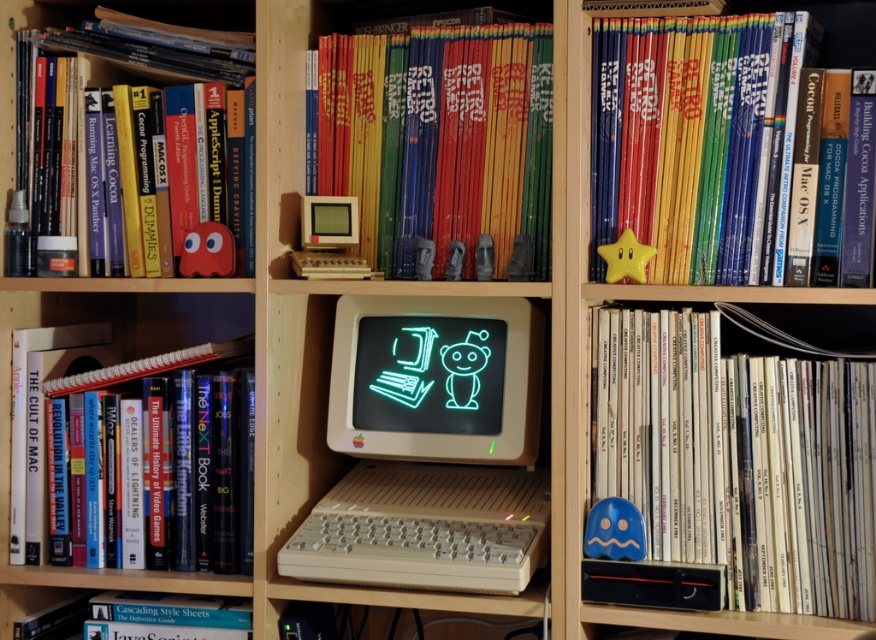
Question: Which point is closer to the camera taking this photo?

Choices:
 (A) click(79, 195)
 (B) click(708, 40)
 (C) click(668, 369)
 (D) click(27, 369)

Answer: (B)

Question: Does blue matte vinyl record at lower right lie in front of spiral-bound paper notebook at left?

Choices:
 (A) yes
 (B) no

Answer: (A)

Question: Is white plastic computer at center closer to camera compared to spiral-bound paper notebook at left?

Choices:
 (A) no
 (B) yes

Answer: (B)

Question: Which point is closer to the camera?

Choices:
 (A) (403, 301)
 (B) (66, 109)
 (C) (689, 428)
 (D) (411, 316)

Answer: (C)

Question: Which point is closer to the camera?

Choices:
 (A) (72, 630)
 (B) (62, 86)
 (C) (641, 163)
 (D) (807, 410)

Answer: (D)

Question: Does hardcover book at center appear under hardcover book at lower left?

Choices:
 (A) yes
 (B) no

Answer: (B)